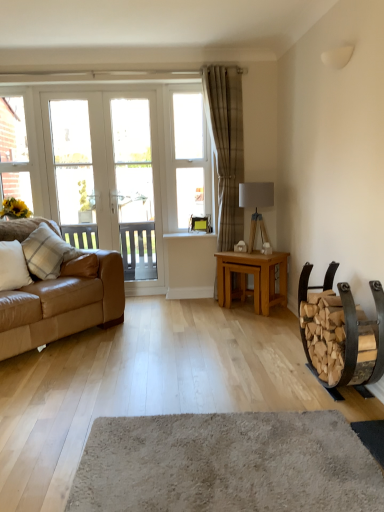
Where is `free space above white plastic window frame at upper left, which is the 1th window frame in left-to-right order (from a real-world perspective)`? This screenshot has height=512, width=384. free space above white plastic window frame at upper left, which is the 1th window frame in left-to-right order (from a real-world perspective) is located at coordinates (14, 83).